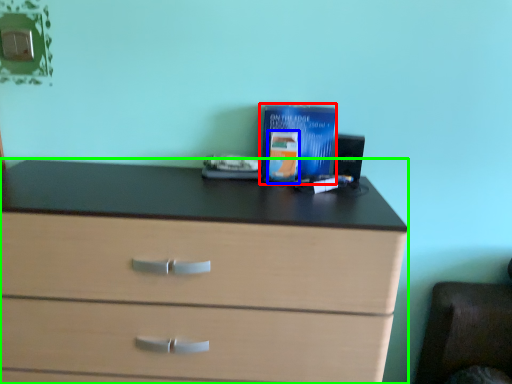
Question: Which object is the farthest from paperback book (highlighted by a red box)? Choose among these: paperback book (highlighted by a blue box) or chest of drawers (highlighted by a green box).

Choices:
 (A) paperback book
 (B) chest of drawers

Answer: (B)